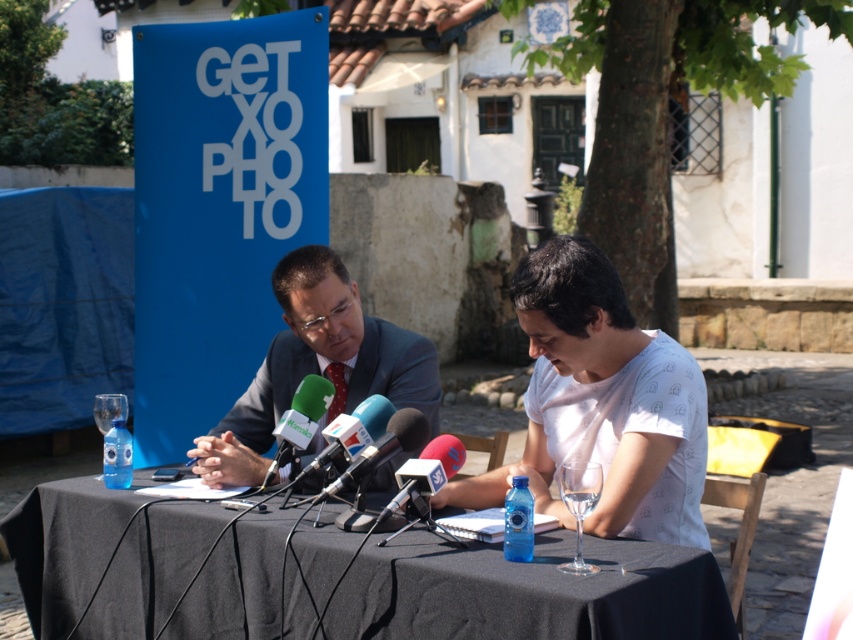
Question: Which object is positioned farthest from the red foam microphone at center?

Choices:
 (A) white cotton shirt at center
 (B) black fabric table at center
 (C) matte black suit at center

Answer: (B)

Question: Based on their relative distances, which object is farther from the transparent plastic bottle at table center?

Choices:
 (A) red foam microphone at center
 (B) matte black suit at center
 (C) blue fabric microphone at center

Answer: (A)

Question: Which is nearer to the matte black suit at center?

Choices:
 (A) white cotton shirt at center
 (B) transparent plastic bottle at table center
 (C) black fabric table at center

Answer: (B)

Question: Can you confirm if transparent plastic bottle at center is positioned to the left of transparent plastic bottle at table center?

Choices:
 (A) yes
 (B) no

Answer: (B)

Question: Is green fabric microphone at center closer to camera compared to blue fabric microphone at center?

Choices:
 (A) no
 (B) yes

Answer: (A)

Question: Can you confirm if green fabric microphone at center is positioned to the right of red foam microphone at center?

Choices:
 (A) no
 (B) yes

Answer: (A)